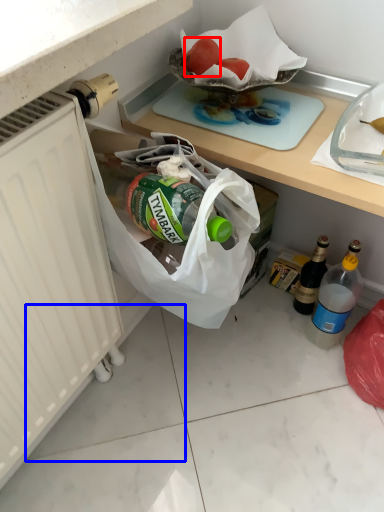
Question: Among these objects, which one is farthest to the camera, fruit (highlighted by a red box) or tile (highlighted by a blue box)?

Choices:
 (A) fruit
 (B) tile

Answer: (B)